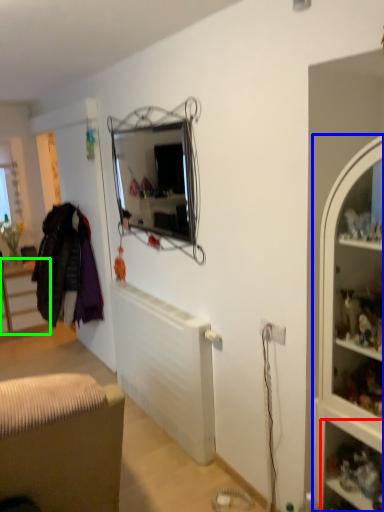
Question: Estimate the real-world distances between objects in this image. Which object is closer to shelf (highlighted by a red box), cabinet (highlighted by a blue box) or cabinetry (highlighted by a green box)?

Choices:
 (A) cabinet
 (B) cabinetry

Answer: (A)